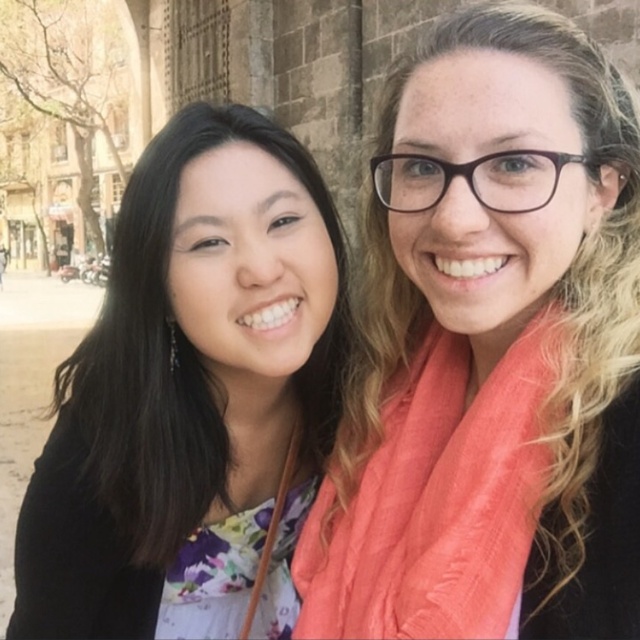
In the scene shown: You are a photographer setting up a shot of the coral scarf at right and the floral fabric dress at center. Which object should you focus on first to ensure both are in sharp focus?

The coral scarf at right is in front of the floral fabric dress at center, so you should focus on the coral scarf at right first to ensure both are in sharp focus.

You are a photographer trying to capture a group photo of the two people in the scene. You notice the coral scarf at right and the coral silk scarf at right are currently 1.14 meters apart. To ensure both scarfs are in frame, what is the minimum width of the camera lens you should use?

The coral scarf at right and the coral silk scarf at right are 1.14 meters apart from each other. To ensure both are in frame, the camera lens should have a minimum width of 1.14 meters.

You are a photographer trying to capture both the coral scarf at right and the floral fabric dress at center in the same frame. Given that your camera has a maximum focus range of 6 meters, will you be able to include both in the shot?

The coral scarf at right and floral fabric dress at center are 6.11 meters apart. Since the distance between them exceeds the camera maximum focus range of 6 meters, you won not be able to include both in the shot.